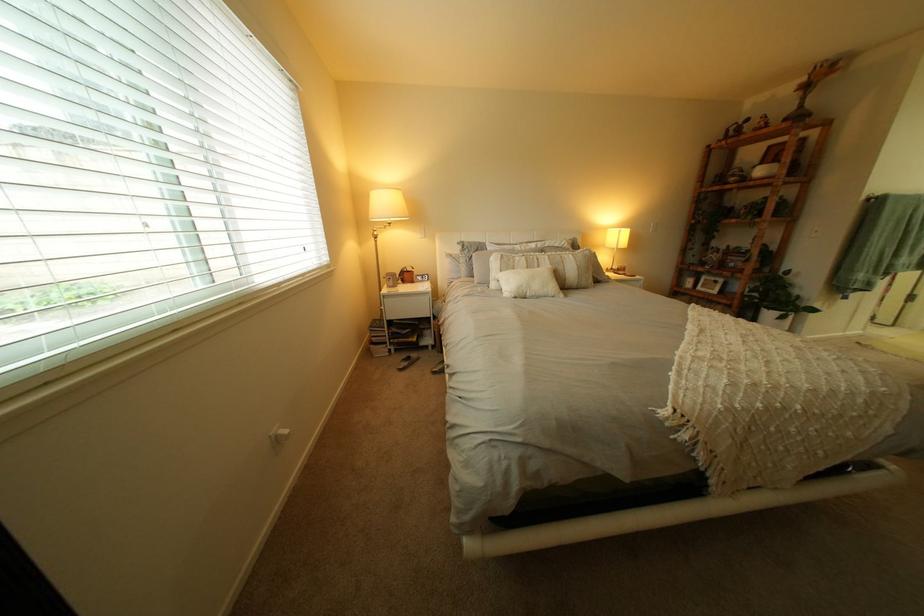
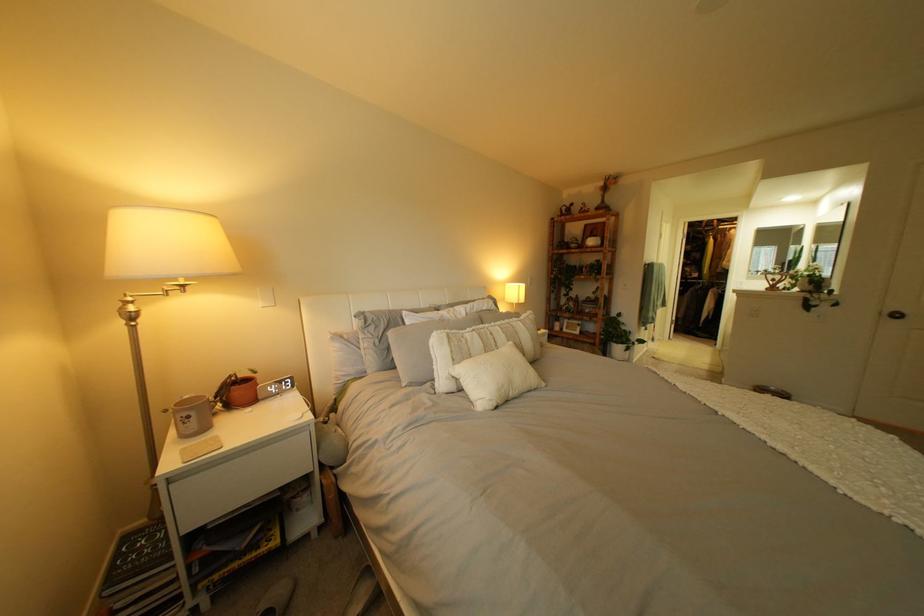
In the second image, find the point that corresponds to point 415,277 in the first image.

(232, 399)